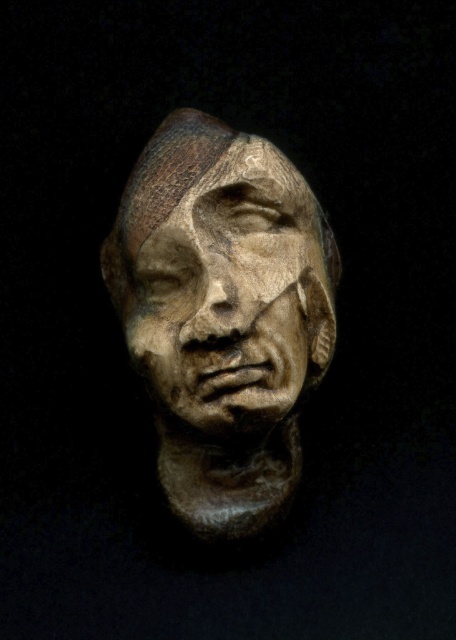
Between point (186, 269) and point (289, 342), which one is positioned behind?

Point (289, 342)

You are a GUI agent. You are given a task and a screenshot of the screen. Output one action in this format:
    pyautogui.click(x=<x>, y=<y>)
    Task: Click on the wooden sculpture at center
    
    Given the screenshot: What is the action you would take?
    pyautogui.click(x=222, y=316)

Locate an element on the screen. The height and width of the screenshot is (640, 456). wooden sculpture at center is located at coordinates (222, 316).